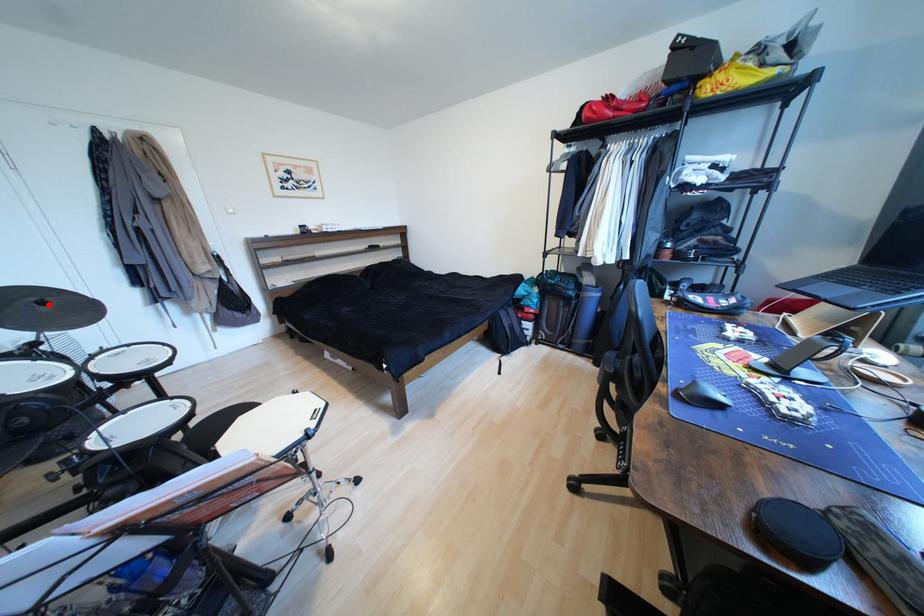
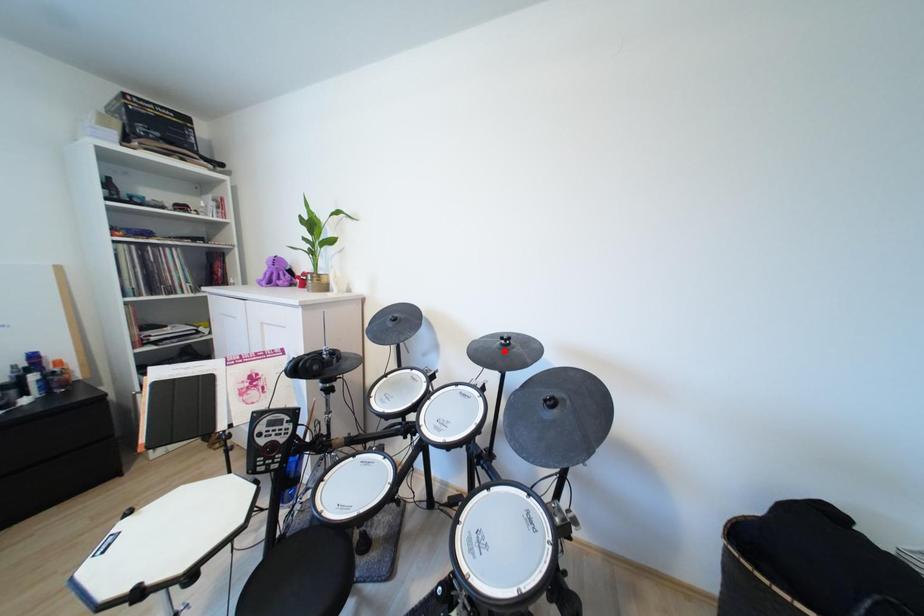
I am providing you with two images of the same scene from different viewpoints. A red point is marked on the first image and another point is marked on the second image. Does the point marked in image1 correspond to the same location as the one in image2?

No